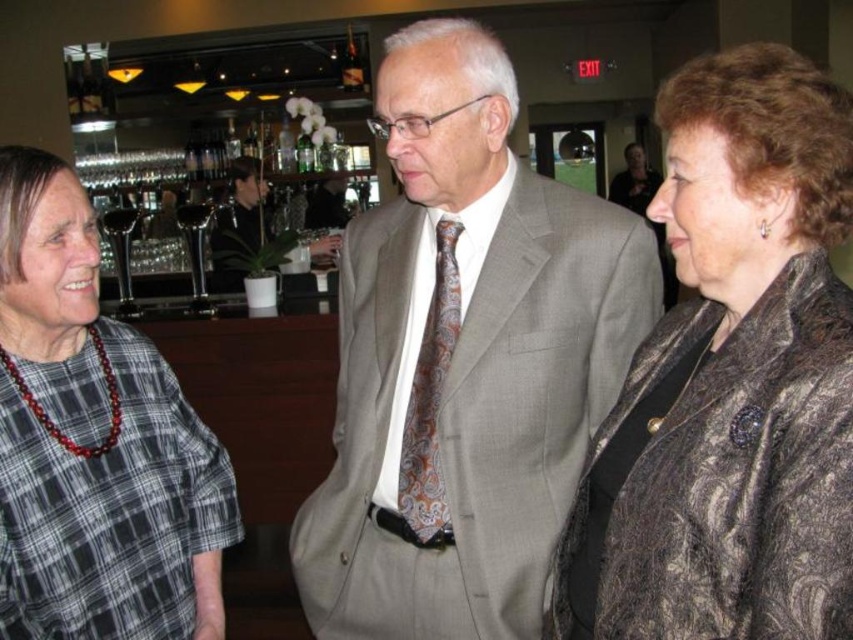
Who is positioned more to the left, light gray suit at center or plaid fabric shirt at left?

Positioned to the left is plaid fabric shirt at left.

Between light gray suit at center and plaid fabric shirt at left, which one has less height?

Standing shorter between the two is plaid fabric shirt at left.

Image resolution: width=853 pixels, height=640 pixels. Describe the element at coordinates (463, 360) in the screenshot. I see `light gray suit at center` at that location.

The width and height of the screenshot is (853, 640). I want to click on light gray suit at center, so click(463, 360).

Which of these two, shiny brown leather jacket at center right or paisley-patterned silk tie at center, stands taller?

With more height is shiny brown leather jacket at center right.

Does shiny brown leather jacket at center right appear over paisley-patterned silk tie at center?

Yes.

This screenshot has height=640, width=853. Describe the element at coordinates (730, 380) in the screenshot. I see `shiny brown leather jacket at center right` at that location.

I want to click on shiny brown leather jacket at center right, so click(730, 380).

Who is positioned more to the right, plaid fabric shirt at left or paisley-patterned silk tie at center?

paisley-patterned silk tie at center

Does plaid fabric shirt at left appear over paisley-patterned silk tie at center?

Actually, plaid fabric shirt at left is below paisley-patterned silk tie at center.

What do you see at coordinates (96, 442) in the screenshot? This screenshot has height=640, width=853. I see `plaid fabric shirt at left` at bounding box center [96, 442].

Where is `plaid fabric shirt at left`? plaid fabric shirt at left is located at coordinates (96, 442).